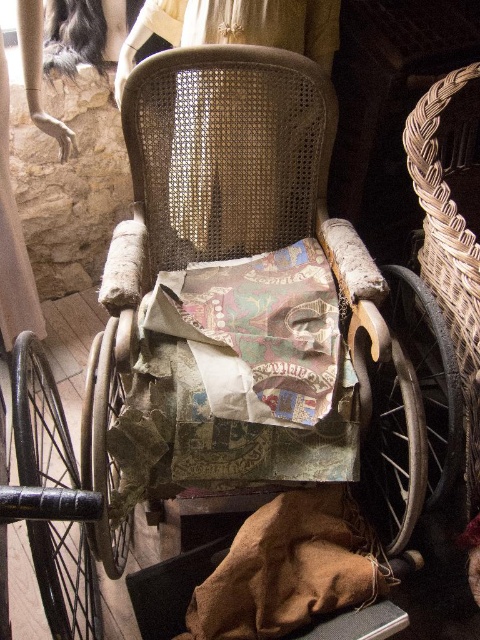
You are standing in front of the vintage wheelchair and want to place two objects on it. The first object should be placed at point A, which corresponds to point (151, 180), and the second object at point B, which is point (447, 280). Which point is closer to you when you are facing the wheelchair?

Point A, which is point (151, 180), is closer to you because it is further to the viewer than point B, point (447, 280).

You are standing in a museum and see the worn wood chair at center and the woven brown basket at right. Which object is closer to the entrance of the museum?

The worn wood chair at center is closer to the entrance of the museum because it is positioned to the left of the woven brown basket at right, and in many settings, objects placed to the left are typically closer to the entrance when viewed from the front.

You are a museum curator planning to display the worn wood chair at center and the woven brown basket at right together in an exhibition. The display area has a narrow shelf that can only accommodate items up to 50 cm in width. Given the information provided, which item should you prioritize placing on the shelf first to ensure both can fit?

The woven brown basket at right should be placed first since the worn wood chair at center is wider and may not fit if placed after the basket due to its larger width.